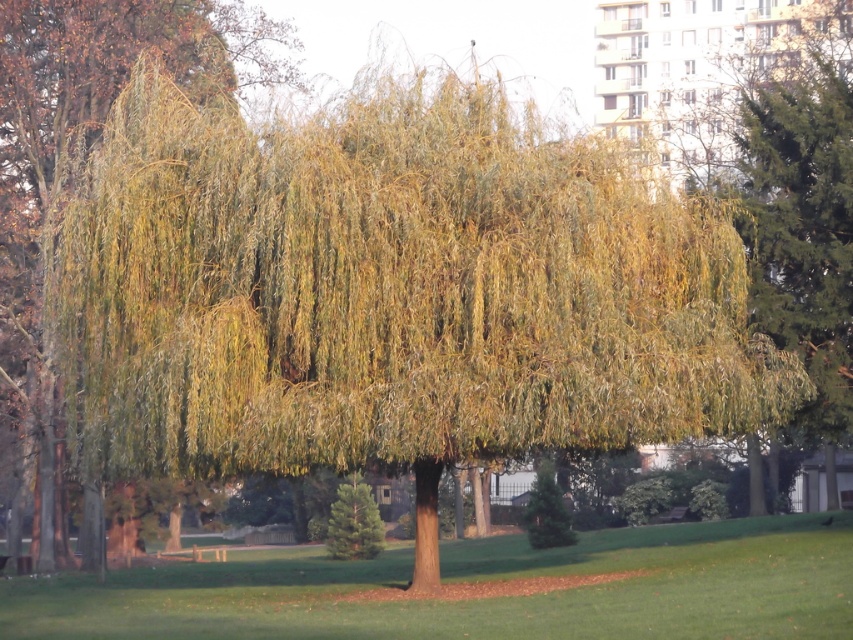
Question: Can you confirm if green grass at center is positioned to the left of yellow-green leafy tree at right?

Choices:
 (A) yes
 (B) no

Answer: (A)

Question: Which object is positioned farthest from the green grass at center?

Choices:
 (A) yellow-green leafy tree at right
 (B) green leafy tree at center

Answer: (A)

Question: Can you confirm if green grass at center is bigger than yellow-green leafy tree at right?

Choices:
 (A) no
 (B) yes

Answer: (A)

Question: Can you confirm if green grass at center is wider than green leafy tree at center?

Choices:
 (A) no
 (B) yes

Answer: (B)

Question: Which point is farther to the camera?

Choices:
 (A) click(x=47, y=445)
 (B) click(x=297, y=576)
 (C) click(x=834, y=353)

Answer: (A)

Question: Which of the following is the closest to the observer?

Choices:
 (A) (828, 531)
 (B) (67, 92)
 (C) (817, 58)

Answer: (A)